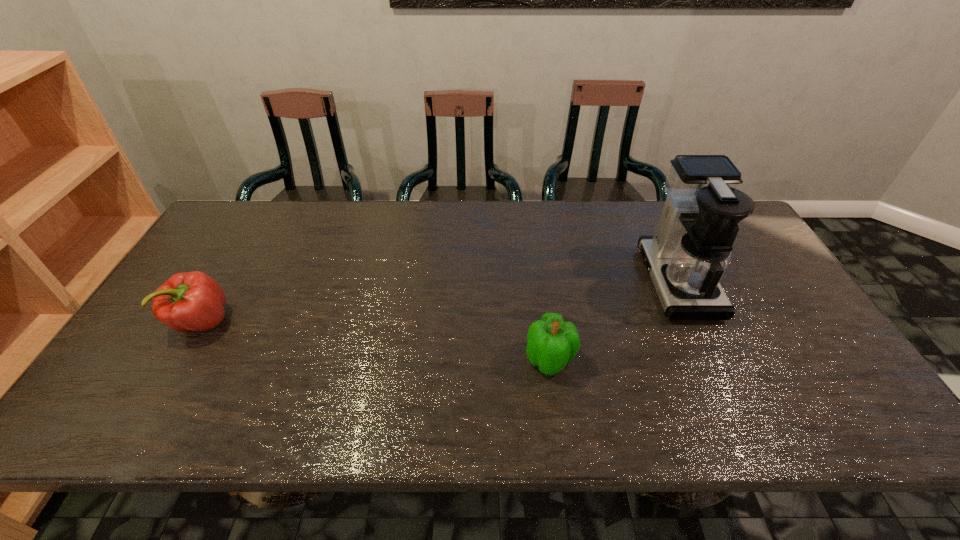
You are a GUI agent. You are given a task and a screenshot of the screen. Output one action in this format:
    pyautogui.click(x=<x>, y=<y>)
    Task: Click on the blank region between the coffee maker and the second object from right to left
    This screenshot has width=960, height=540.
    Given the screenshot: What is the action you would take?
    pyautogui.click(x=613, y=321)

At what (x,y) coordinates should I click in order to perform the action: click on free space between the second object from right to left and the left bell pepper. Please return your answer as a coordinate pair (x, y). The width and height of the screenshot is (960, 540). Looking at the image, I should click on (375, 341).

What are the coordinates of `vacant point located between the leftmost object and the tallest object` in the screenshot? It's located at (440, 302).

Identify the location of free space between the right bell pepper and the left bell pepper. (375, 341).

Image resolution: width=960 pixels, height=540 pixels. Identify the location of unoccupied position between the leftmost object and the coffee maker. (440, 302).

Locate an element on the screen. The image size is (960, 540). the closest object to the leftmost object is located at coordinates (552, 343).

You are a GUI agent. You are given a task and a screenshot of the screen. Output one action in this format:
    pyautogui.click(x=<x>, y=<y>)
    Task: Click on the object that can be found as the second closest to the right bell pepper
    This screenshot has width=960, height=540.
    Given the screenshot: What is the action you would take?
    pyautogui.click(x=193, y=301)

Identify the location of vacant region that satisfies the following two spatial constraints: 1. at the front of the tallest object where the controls are located; 2. on the front side of the left bell pepper. (696, 322).

The height and width of the screenshot is (540, 960). What are the coordinates of `free space in the image that satisfies the following two spatial constraints: 1. on the front side of the right bell pepper; 2. on the right side of the leftmost object` in the screenshot? It's located at (180, 360).

Locate an element on the screen. free space that satisfies the following two spatial constraints: 1. on the front side of the leftmost object; 2. on the left side of the right bell pepper is located at coordinates (180, 360).